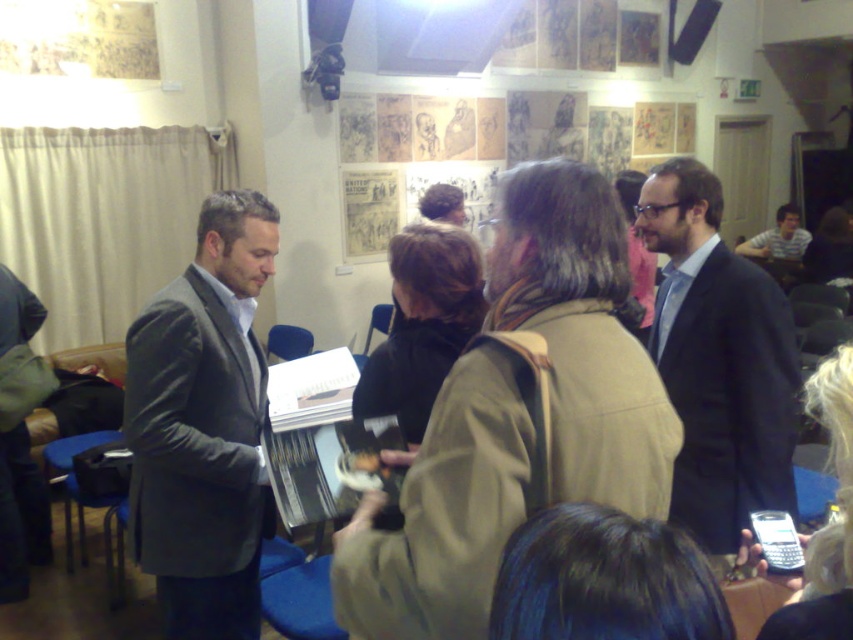
Question: Which point appears farthest from the camera in this image?

Choices:
 (A) pos(190,374)
 (B) pos(761,250)

Answer: (B)

Question: Can you confirm if matte gray suit at center is wider than dark blue suit at center?

Choices:
 (A) yes
 (B) no

Answer: (B)

Question: Which object is farther from the camera taking this photo?

Choices:
 (A) dark blue suit at center
 (B) striped shirt at center

Answer: (B)

Question: Based on their relative distances, which object is nearer to the matte gray suit at center?

Choices:
 (A) striped shirt at center
 (B) dark blue suit at center

Answer: (B)

Question: Is matte gray suit at center behind dark blue suit at center?

Choices:
 (A) yes
 (B) no

Answer: (A)

Question: Does matte gray suit at center appear over striped shirt at center?

Choices:
 (A) yes
 (B) no

Answer: (B)